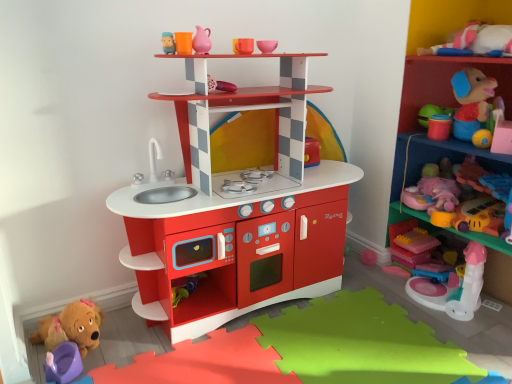
What do you see at coordinates (267, 46) in the screenshot? The image size is (512, 384). I see `pink matte cup at upper center, which is the sixth toy from left to right` at bounding box center [267, 46].

The width and height of the screenshot is (512, 384). I want to click on pink matte pitcher at upper center, which ranks as the seventh toy in right-to-left order, so click(x=202, y=41).

The width and height of the screenshot is (512, 384). Describe the element at coordinates (237, 212) in the screenshot. I see `smooth plastic shelf at center, which ranks as the second shelf in right-to-left order` at that location.

The height and width of the screenshot is (384, 512). Describe the element at coordinates (71, 327) in the screenshot. I see `brown plush dog at lower left, acting as the 1th toy starting from the left` at that location.

I want to click on purple plastic potty at lower left, acting as the 2th toy starting from the left, so click(63, 363).

Where is `pink plush toy at right, which is the 1th toy in right-to-left order`? The width and height of the screenshot is (512, 384). pink plush toy at right, which is the 1th toy in right-to-left order is located at coordinates [467, 201].

Image resolution: width=512 pixels, height=384 pixels. I want to click on matte plastic spoon at upper center, which appears as the fourth toy when viewed from the left, so click(x=220, y=85).

How much space does translucent plastic blocks at lower right, which ranks as the second toy in right-to-left order, occupy vertically?

2.40 inches.

The image size is (512, 384). In order to click on translucent plastic blocks at lower right, which ranks as the second toy in right-to-left order in this screenshot , I will do `click(416, 241)`.

What are the coordinates of `pink matte cup at upper center, marked as the 4th toy in a right-to-left arrangement` in the screenshot? It's located at (267, 46).

From a real-world perspective, starting from the pink matte pitcher at upper center, which ranks as the seventh toy in right-to-left order, which toy is the 3rd one below it? Please provide its 2D coordinates.

[(220, 85)]

Considering the sizes of objects pink matte pitcher at upper center, the 3th toy positioned from the left, and matte plastic spoon at upper center, which appears as the fourth toy when viewed from the left, in the image provided, who is shorter, pink matte pitcher at upper center, the 3th toy positioned from the left, or matte plastic spoon at upper center, which appears as the fourth toy when viewed from the left,?

Standing shorter between the two is matte plastic spoon at upper center, which appears as the fourth toy when viewed from the left.

Can we say pink matte pitcher at upper center, which ranks as the seventh toy in right-to-left order, lies outside matte plastic spoon at upper center, arranged as the sixth toy when viewed from the right?

Absolutely, pink matte pitcher at upper center, which ranks as the seventh toy in right-to-left order, is external to matte plastic spoon at upper center, arranged as the sixth toy when viewed from the right.

Which point is more distant from viewer, (207, 52) or (231, 84)?

Positioned behind is point (231, 84).

Consider the image. Is the depth of brown plush dog at lower left, which is the ninth toy in right-to-left order, greater than that of matte plastic spoon at upper center, arranged as the sixth toy when viewed from the right?

No, brown plush dog at lower left, which is the ninth toy in right-to-left order, is closer to the camera.

Is brown plush dog at lower left, acting as the 1th toy starting from the left, oriented away from matte plastic spoon at upper center, arranged as the sixth toy when viewed from the right?

brown plush dog at lower left, acting as the 1th toy starting from the left, is not turned away from matte plastic spoon at upper center, arranged as the sixth toy when viewed from the right.

Would you say brown plush dog at lower left, acting as the 1th toy starting from the left, is outside matte plastic spoon at upper center, arranged as the sixth toy when viewed from the right?

brown plush dog at lower left, acting as the 1th toy starting from the left, lies outside matte plastic spoon at upper center, arranged as the sixth toy when viewed from the right,'s area.

Between brown plush dog at lower left, which is the ninth toy in right-to-left order, and purple plastic potty at lower left, acting as the 2th toy starting from the left, which one has smaller size?

purple plastic potty at lower left, acting as the 2th toy starting from the left, is smaller.

Is brown plush dog at lower left, which is the ninth toy in right-to-left order, to the right of purple plastic potty at lower left, acting as the 2th toy starting from the left, from the viewer's perspective?

In fact, brown plush dog at lower left, which is the ninth toy in right-to-left order, is to the left of purple plastic potty at lower left, acting as the 2th toy starting from the left.

From a real-world perspective, which toy is the 1st one underneath the brown plush dog at lower left, acting as the 1th toy starting from the left? Please provide its 2D coordinates.

[(63, 363)]

What's the angular difference between brown plush dog at lower left, which is the ninth toy in right-to-left order, and purple plastic potty at lower left, acting as the 2th toy starting from the left,'s facing directions?

They differ by 0.000912 degrees in their facing directions.

From a real-world perspective, is rubberized plastic toys at upper right, which is the first shelf from right to left, positioned over pink plastic unicorn at upper right, which ranks as the seventh toy in left-to-right order, based on gravity?

Yes, from a real-world perspective, rubberized plastic toys at upper right, which is the first shelf from right to left, is on top of pink plastic unicorn at upper right, which ranks as the seventh toy in left-to-right order.

Is rubberized plastic toys at upper right, marked as the 2th shelf in a left-to-right arrangement, facing towards pink plastic unicorn at upper right, acting as the third toy starting from the right?

No, rubberized plastic toys at upper right, marked as the 2th shelf in a left-to-right arrangement, is not turned towards pink plastic unicorn at upper right, acting as the third toy starting from the right.

This screenshot has width=512, height=384. Identify the location of the 2nd shelf above when counting from the pink plastic unicorn at upper right, acting as the third toy starting from the right (from the image's perspective). (436, 104).

Considering the points (494, 247) and (470, 248), which point is in front, point (494, 247) or point (470, 248)?

The point (494, 247) is closer to the camera.

From the image's perspective, which toy is the 1st one below the translucent plastic blocks at lower right, which appears as the 8th toy when viewed from the left? Please provide its 2D coordinates.

[(454, 287)]

From their relative heights in the image, would you say translucent plastic blocks at lower right, which appears as the 8th toy when viewed from the left, is taller or shorter than pink plastic unicorn at upper right, acting as the third toy starting from the right?

translucent plastic blocks at lower right, which appears as the 8th toy when viewed from the left, is shorter than pink plastic unicorn at upper right, acting as the third toy starting from the right.

From the image's perspective, does translucent plastic blocks at lower right, which ranks as the second toy in right-to-left order, appear higher than pink plastic unicorn at upper right, acting as the third toy starting from the right?

Yes, from the image's perspective, translucent plastic blocks at lower right, which ranks as the second toy in right-to-left order, is on top of pink plastic unicorn at upper right, acting as the third toy starting from the right.

In the image, is translucent plastic blocks at lower right, which appears as the 8th toy when viewed from the left, positioned in front of or behind pink plastic unicorn at upper right, acting as the third toy starting from the right?

In the image, translucent plastic blocks at lower right, which appears as the 8th toy when viewed from the left, appears behind pink plastic unicorn at upper right, acting as the third toy starting from the right.

Considering their positions, is pink matte cup at upper center, marked as the 4th toy in a right-to-left arrangement, located in front of or behind pink plush toy at right, which is the 1th toy in right-to-left order?

Clearly, pink matte cup at upper center, marked as the 4th toy in a right-to-left arrangement, is in front of pink plush toy at right, which is the 1th toy in right-to-left order.

Does pink matte cup at upper center, marked as the 4th toy in a right-to-left arrangement, have a lesser width compared to pink plush toy at right, which is the 1th toy in right-to-left order?

Yes.

Would you say pink plush toy at right, which ranks as the 9th toy in left-to-right order, is part of pink matte cup at upper center, marked as the 4th toy in a right-to-left arrangement,'s contents?

No, pink matte cup at upper center, marked as the 4th toy in a right-to-left arrangement, does not contain pink plush toy at right, which ranks as the 9th toy in left-to-right order.

Is pink matte cup at upper center, which is the sixth toy from left to right, positioned far away from pink plush toy at right, which is the 1th toy in right-to-left order?

That's right, there is a large distance between pink matte cup at upper center, which is the sixth toy from left to right, and pink plush toy at right, which is the 1th toy in right-to-left order.

Is the position of matte pink cup at upper center, which ranks as the fifth toy in left-to-right order, more distant than that of smooth plastic shelf at center, which ranks as the second shelf in right-to-left order?

Yes.

From the image's perspective, which object appears higher, matte pink cup at upper center, marked as the fifth toy in a right-to-left arrangement, or smooth plastic shelf at center, which ranks as the second shelf in right-to-left order?

From the image's view, matte pink cup at upper center, marked as the fifth toy in a right-to-left arrangement, is above.

In the scene shown: Is matte pink cup at upper center, which ranks as the fifth toy in left-to-right order, completely or partially outside of smooth plastic shelf at center, the 1th shelf viewed from the left?

Yes, matte pink cup at upper center, which ranks as the fifth toy in left-to-right order, is not within smooth plastic shelf at center, the 1th shelf viewed from the left.

Based on their positions, is matte pink cup at upper center, which ranks as the fifth toy in left-to-right order, located to the left or right of smooth plastic shelf at center, the 1th shelf viewed from the left?

Based on their positions, matte pink cup at upper center, which ranks as the fifth toy in left-to-right order, is located to the left of smooth plastic shelf at center, the 1th shelf viewed from the left.

Find the location of `the 2nd toy behind the pink matte pitcher at upper center, the 3th toy positioned from the left, starting your count from the anchor`. the 2nd toy behind the pink matte pitcher at upper center, the 3th toy positioned from the left, starting your count from the anchor is located at coordinates (220, 85).

This screenshot has width=512, height=384. Find the location of `the 3rd toy above the brown plush dog at lower left, acting as the 1th toy starting from the left (from a real-world perspective)`. the 3rd toy above the brown plush dog at lower left, acting as the 1th toy starting from the left (from a real-world perspective) is located at coordinates (220, 85).

Which object lies further to the anchor point pink plush toy at right, which ranks as the 9th toy in left-to-right order, purple plastic potty at lower left, arranged as the 8th toy when viewed from the right, or pink matte pitcher at upper center, the 3th toy positioned from the left?

Among the two, purple plastic potty at lower left, arranged as the 8th toy when viewed from the right, is located further to pink plush toy at right, which ranks as the 9th toy in left-to-right order.

Considering their positions, is rubberized plastic toys at upper right, which is the first shelf from right to left, positioned closer to smooth plastic shelf at center, which ranks as the second shelf in right-to-left order, than matte pink cup at upper center, which ranks as the fifth toy in left-to-right order?

matte pink cup at upper center, which ranks as the fifth toy in left-to-right order, lies closer to smooth plastic shelf at center, which ranks as the second shelf in right-to-left order, than the other object.

Estimate the real-world distances between objects in this image. Which object is further from pink plastic unicorn at upper right, which ranks as the seventh toy in left-to-right order, purple plastic potty at lower left, acting as the 2th toy starting from the left, or pink plush toy at right, which ranks as the 9th toy in left-to-right order?

The object further to pink plastic unicorn at upper right, which ranks as the seventh toy in left-to-right order, is purple plastic potty at lower left, acting as the 2th toy starting from the left.

Based on their spatial positions, is translucent plastic blocks at lower right, which ranks as the second toy in right-to-left order, or brown plush dog at lower left, which is the ninth toy in right-to-left order, closer to matte pink cup at upper center, marked as the fifth toy in a right-to-left arrangement?

Based on the image, brown plush dog at lower left, which is the ninth toy in right-to-left order, appears to be nearer to matte pink cup at upper center, marked as the fifth toy in a right-to-left arrangement.

Considering their positions, is smooth plastic shelf at center, the 1th shelf viewed from the left, positioned closer to rubberized plastic toys at upper right, marked as the 2th shelf in a left-to-right arrangement, than pink plush toy at right, which is the 1th toy in right-to-left order?

pink plush toy at right, which is the 1th toy in right-to-left order, lies closer to rubberized plastic toys at upper right, marked as the 2th shelf in a left-to-right arrangement, than the other object.

Considering their positions, is matte plastic spoon at upper center, arranged as the sixth toy when viewed from the right, positioned closer to purple plastic potty at lower left, acting as the 2th toy starting from the left, than pink matte cup at upper center, marked as the 4th toy in a right-to-left arrangement?

matte plastic spoon at upper center, arranged as the sixth toy when viewed from the right, is positioned closer to the anchor purple plastic potty at lower left, acting as the 2th toy starting from the left.

Looking at the image, which one is located further to pink plastic unicorn at upper right, acting as the third toy starting from the right, smooth plastic shelf at center, which ranks as the second shelf in right-to-left order, or brown plush dog at lower left, which is the ninth toy in right-to-left order?

brown plush dog at lower left, which is the ninth toy in right-to-left order, lies further to pink plastic unicorn at upper right, acting as the third toy starting from the right, than the other object.

In the scene shown: When comparing their distances from brown plush dog at lower left, acting as the 1th toy starting from the left, does matte pink cup at upper center, marked as the fifth toy in a right-to-left arrangement, or pink matte pitcher at upper center, the 3th toy positioned from the left, seem closer?

The object closer to brown plush dog at lower left, acting as the 1th toy starting from the left, is pink matte pitcher at upper center, the 3th toy positioned from the left.

This screenshot has height=384, width=512. I want to click on shelf between purple plastic potty at lower left, arranged as the 8th toy when viewed from the right, and pink plastic unicorn at upper right, acting as the third toy starting from the right, so click(x=237, y=212).

Identify the location of toy located between pink plush toy at right, which is the 1th toy in right-to-left order, and translucent plastic blocks at lower right, which ranks as the second toy in right-to-left order, in the depth direction. The height and width of the screenshot is (384, 512). (454, 287).

Image resolution: width=512 pixels, height=384 pixels. In order to click on shelf between purple plastic potty at lower left, arranged as the 8th toy when viewed from the right, and translucent plastic blocks at lower right, which appears as the 8th toy when viewed from the left in this screenshot , I will do [x=237, y=212].

You are a GUI agent. You are given a task and a screenshot of the screen. Output one action in this format:
    pyautogui.click(x=<x>, y=<y>)
    Task: Click on the shelf between matte pink cup at upper center, which ranks as the fifth toy in left-to-right order, and pink plastic unicorn at upper right, acting as the third toy starting from the right, from left to right
    This screenshot has height=384, width=512.
    Given the screenshot: What is the action you would take?
    pyautogui.click(x=237, y=212)